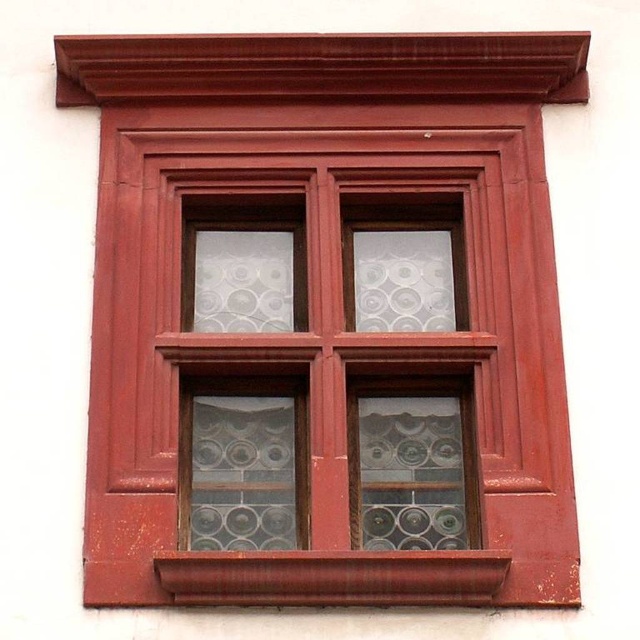
Between stained glass window at center and smooth wood window sill at bottom, which one is positioned lower?

Positioned lower is smooth wood window sill at bottom.

Based on the photo, who is more distant from viewer, [442,420] or [221,568]?

The point [442,420] is behind.

Find the location of a particular element. Image resolution: width=640 pixels, height=640 pixels. stained glass window at center is located at coordinates (330, 362).